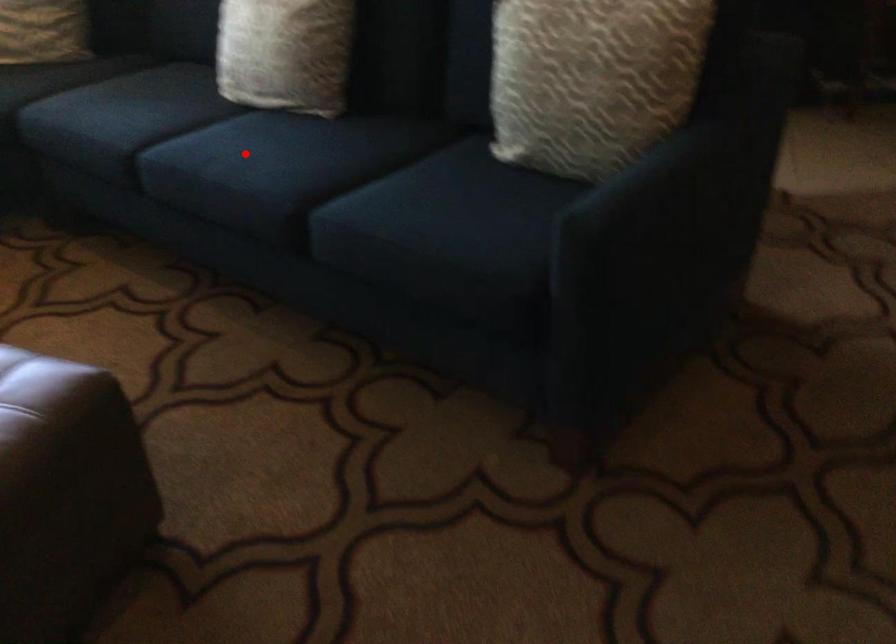
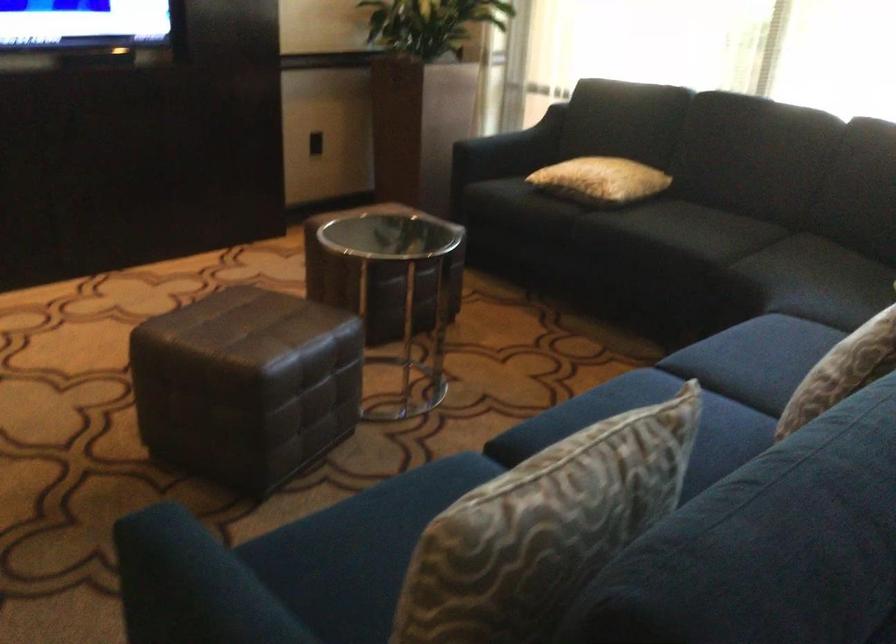
Question: I am providing you with two images of the same scene from different viewpoints. A red point is marked on the first image. Can you still see the location of the red point in image 2?

Choices:
 (A) Yes
 (B) No

Answer: (B)